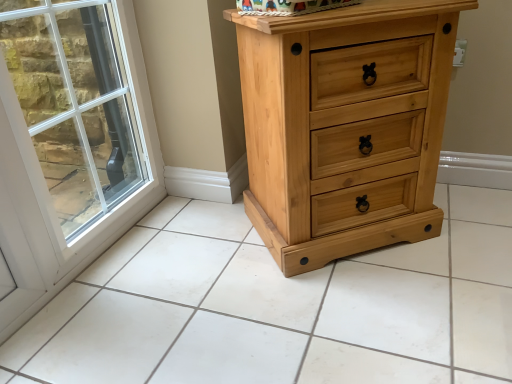
Describe the element at coordinates (345, 126) in the screenshot. I see `natural wood chest of drawers at right` at that location.

I want to click on natural wood chest of drawers at right, so click(345, 126).

At what (x,y) coordinates should I click in order to perform the action: click on white glass window at left. Please return your answer as a coordinate pair (x, y). Image resolution: width=512 pixels, height=384 pixels. Looking at the image, I should click on (70, 143).

Where is `natural wood tile at center`? This screenshot has width=512, height=384. natural wood tile at center is located at coordinates (280, 306).

From the image's perspective, would you say natural wood chest of drawers at right is shown under natural wood tile at center?

No.

Is point (248, 166) closer or farther from the camera than point (448, 233)?

Point (248, 166) is farther from the camera than point (448, 233).

Looking at the image, does natural wood chest of drawers at right seem bigger or smaller compared to natural wood tile at center?

Considering their sizes, natural wood chest of drawers at right takes up more space than natural wood tile at center.

This screenshot has height=384, width=512. Identify the location of chest of drawers to the right of natural wood tile at center. point(345,126).

From the image's perspective, which is below, natural wood tile at center or white glass window at left?

natural wood tile at center is shown below in the image.

Would you consider natural wood tile at center to be distant from white glass window at left?

natural wood tile at center is near white glass window at left, not far away.

Between natural wood tile at center and white glass window at left, which one has more height?

Standing taller between the two is white glass window at left.

In the image, is natural wood tile at center positioned in front of or behind white glass window at left?

In the image, natural wood tile at center appears in front of white glass window at left.

From a real-world perspective, is natural wood chest of drawers at right positioned above or below white glass window at left?

natural wood chest of drawers at right is situated lower than white glass window at left in the real world.

Can you confirm if natural wood chest of drawers at right is positioned to the right of white glass window at left?

Correct, you'll find natural wood chest of drawers at right to the right of white glass window at left.

Is point (362, 245) closer or farther from the camera than point (117, 52)?

Point (362, 245) is closer to the camera than point (117, 52).

Based on the photo, considering the sizes of objects natural wood chest of drawers at right and white glass window at left in the image provided, who is bigger, natural wood chest of drawers at right or white glass window at left?

natural wood chest of drawers at right is bigger.

Is white glass window at left located outside natural wood chest of drawers at right?

Absolutely, white glass window at left is external to natural wood chest of drawers at right.

The image size is (512, 384). I want to click on window on the left side of natural wood chest of drawers at right, so click(x=70, y=143).

Could you tell me if white glass window at left is turned towards natural wood chest of drawers at right?

Yes, white glass window at left is facing natural wood chest of drawers at right.

Considering the relative sizes of white glass window at left and natural wood chest of drawers at right in the image provided, is white glass window at left bigger than natural wood chest of drawers at right?

Actually, white glass window at left might be smaller than natural wood chest of drawers at right.

Is point (63, 146) closer to viewer compared to point (497, 371)?

That is False.

From a real-world perspective, is white glass window at left beneath natural wood tile at center?

No.

Consider the image. Considering the positions of objects white glass window at left and natural wood tile at center in the image provided, who is in front, white glass window at left or natural wood tile at center?

Positioned in front is natural wood tile at center.

In the scene shown: Considering the sizes of objects white glass window at left and natural wood tile at center in the image provided, who is taller, white glass window at left or natural wood tile at center?

With more height is white glass window at left.

Between natural wood tile at center and natural wood chest of drawers at right, which one has larger size?

With larger size is natural wood chest of drawers at right.

In the image, is natural wood tile at center on the left side or the right side of natural wood chest of drawers at right?

In the image, natural wood tile at center appears on the left side of natural wood chest of drawers at right.

Is natural wood tile at center outside of natural wood chest of drawers at right?

That's correct, natural wood tile at center is outside of natural wood chest of drawers at right.

This screenshot has height=384, width=512. In order to click on the chest of drawers that is above the natural wood tile at center (from the image's perspective) in this screenshot , I will do `click(345, 126)`.

The width and height of the screenshot is (512, 384). Find the location of `tile that is below the white glass window at left (from the image's perspective)`. tile that is below the white glass window at left (from the image's perspective) is located at coordinates (280, 306).

Looking at the image, which one is located further to natural wood tile at center, white glass window at left or natural wood chest of drawers at right?

white glass window at left is further to natural wood tile at center.

Based on their spatial positions, is natural wood chest of drawers at right or natural wood tile at center further from white glass window at left?

natural wood chest of drawers at right.

Which object lies nearer to the anchor point natural wood tile at center, natural wood chest of drawers at right or white glass window at left?

natural wood chest of drawers at right lies closer to natural wood tile at center than the other object.

Based on the photo, estimate the real-world distances between objects in this image. Which object is closer to natural wood chest of drawers at right, white glass window at left or natural wood tile at center?

natural wood tile at center lies closer to natural wood chest of drawers at right than the other object.

Based on their spatial positions, is natural wood tile at center or natural wood chest of drawers at right further from white glass window at left?

Among the two, natural wood chest of drawers at right is located further to white glass window at left.

When comparing their distances from natural wood chest of drawers at right, does natural wood tile at center or white glass window at left seem closer?

natural wood tile at center.

You are a GUI agent. You are given a task and a screenshot of the screen. Output one action in this format:
    pyautogui.click(x=<x>, y=<y>)
    Task: Click on the tile situated between white glass window at left and natural wood chest of drawers at right from left to right
    The width and height of the screenshot is (512, 384).
    Given the screenshot: What is the action you would take?
    pyautogui.click(x=280, y=306)